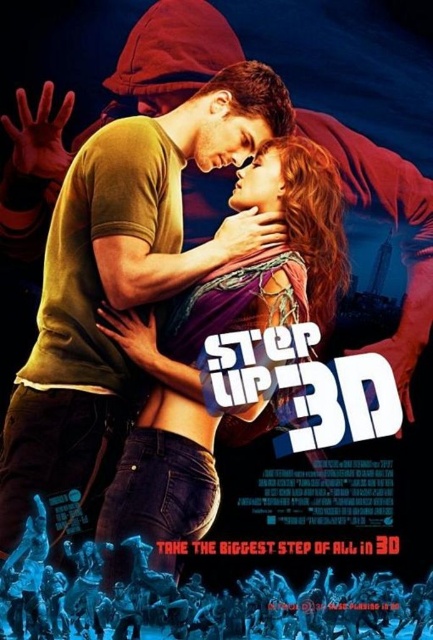
Question: Is matte yellow t-shirt at center positioned in front of matte black jeans at lower left?

Choices:
 (A) no
 (B) yes

Answer: (A)

Question: Can you confirm if matte yellow t-shirt at center is positioned to the right of matte black jeans at lower left?

Choices:
 (A) no
 (B) yes

Answer: (A)

Question: Can you confirm if matte yellow t-shirt at center is positioned to the left of matte black jeans at lower left?

Choices:
 (A) yes
 (B) no

Answer: (A)

Question: Which of the following is the farthest from the observer?

Choices:
 (A) (2, 612)
 (B) (296, 276)

Answer: (B)